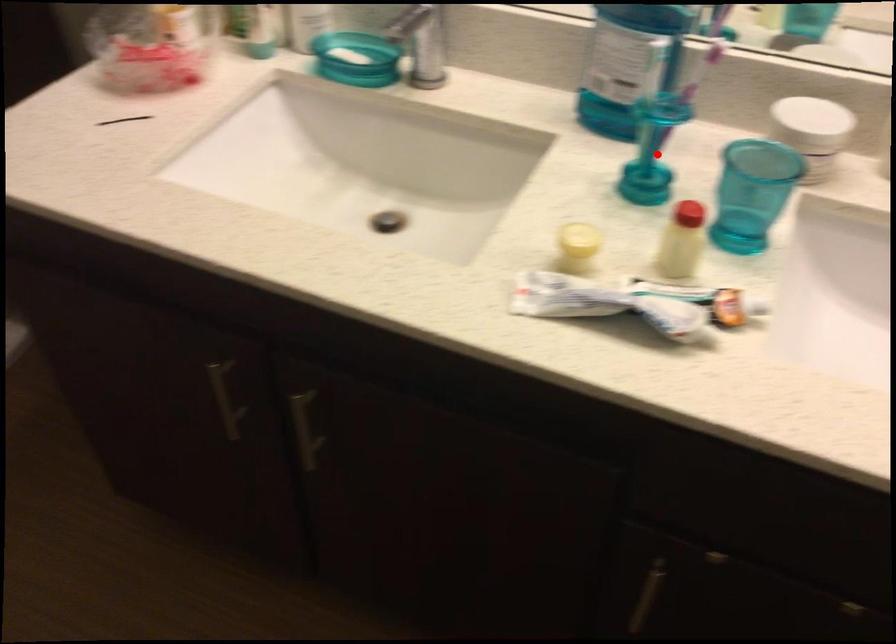
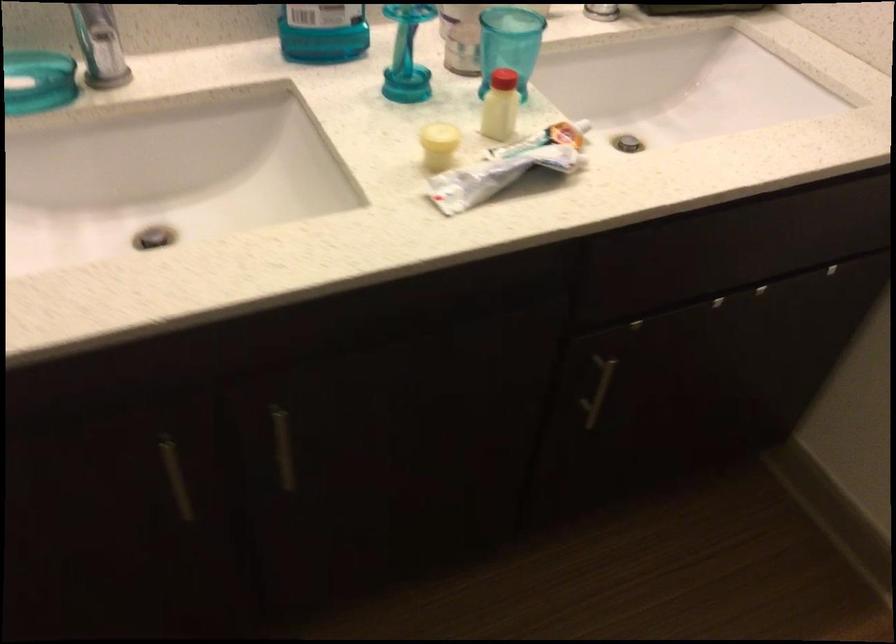
Find the pixel in the second image that matches the highlighted location in the first image.

(407, 55)